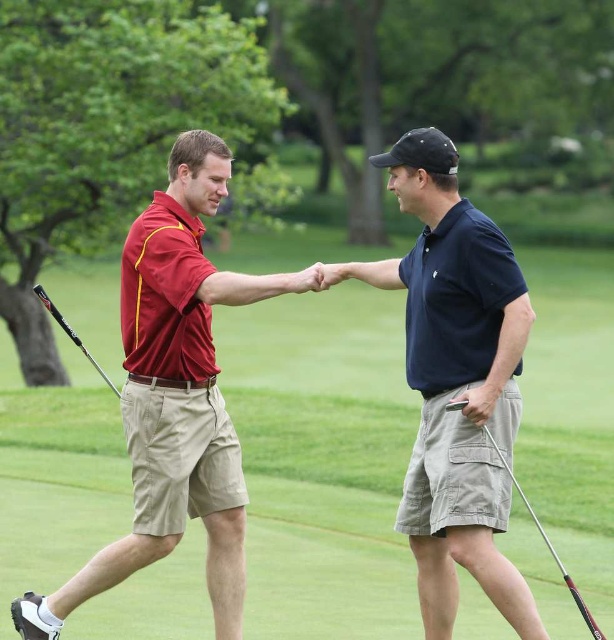
Question: Is metallic silver golf club at lower right in front of shiny black golf club at left?

Choices:
 (A) yes
 (B) no

Answer: (A)

Question: In this image, where is matte red shirt at center located relative to shiny black golf club at left?

Choices:
 (A) right
 (B) left

Answer: (A)

Question: Which object is the closest to the matte red shirt at center?

Choices:
 (A) metallic silver golf club at lower right
 (B) navy blue shirt at center
 (C) green grass at center

Answer: (B)

Question: Which point is closer to the camera taking this photo?

Choices:
 (A) (427, 284)
 (B) (486, 324)
 (C) (157, 260)
 (D) (527, 509)

Answer: (B)

Question: Is navy blue shirt at center to the right of shiny black golf club at left from the viewer's perspective?

Choices:
 (A) yes
 (B) no

Answer: (A)

Question: Which object appears farthest from the camera in this image?

Choices:
 (A) shiny black golf club at left
 (B) navy blue shirt at center

Answer: (B)